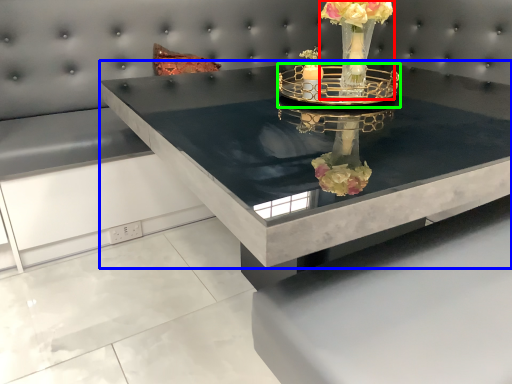
Question: Estimate the real-world distances between objects in this image. Which object is closer to floral arrangement (highlighted by a red box), table (highlighted by a blue box) or candle holder (highlighted by a green box)?

Choices:
 (A) table
 (B) candle holder

Answer: (B)